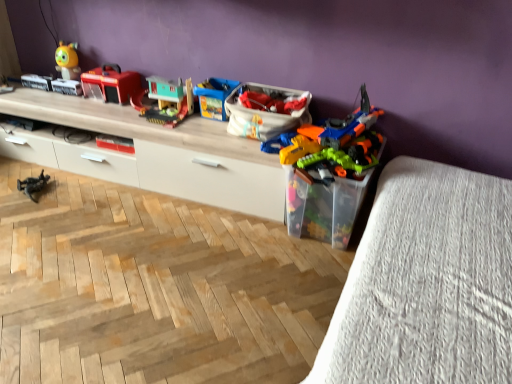
What are the coordinates of `vacant space in between metallic gray toy soldier at lower left, marked as the 1th toy in a left-to-right arrangement, and translucent plastic storage box at center-right, acting as the 1th storage box starting from the bottom` in the screenshot? It's located at (152, 206).